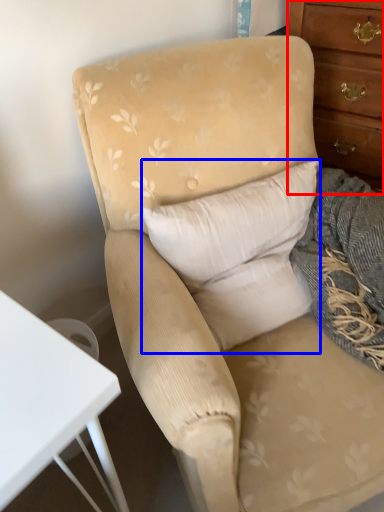
Question: Which of the following is the farthest to the observer, chest of drawers (highlighted by a red box) or pillow (highlighted by a blue box)?

Choices:
 (A) chest of drawers
 (B) pillow

Answer: (A)